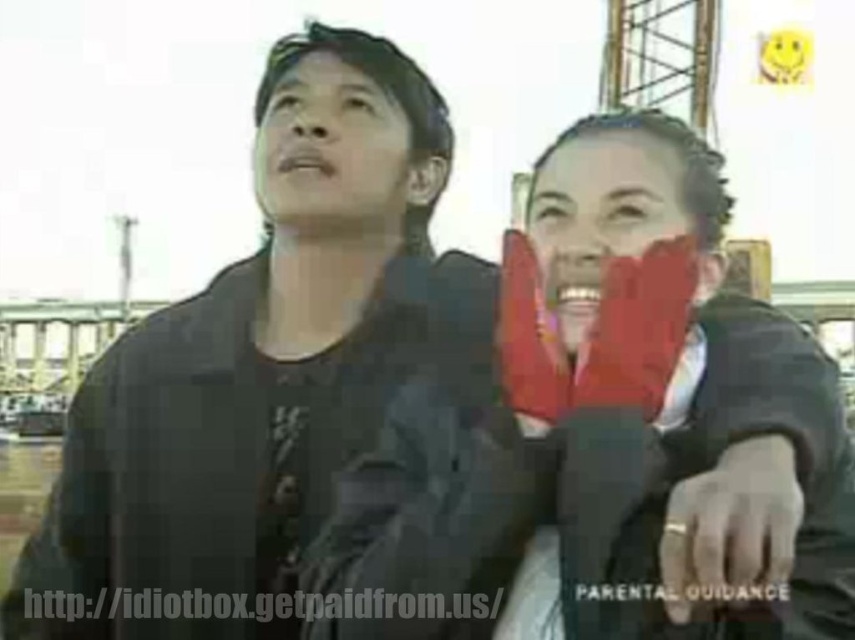
Who is lower down, matte black face at upper center or matte red gloves at center?

matte red gloves at center

Does matte black face at upper center have a greater width compared to matte red gloves at center?

Incorrect, matte black face at upper center's width does not surpass matte red gloves at center's.

Describe the element at coordinates (331, 148) in the screenshot. I see `matte black face at upper center` at that location.

At what (x,y) coordinates should I click in order to perform the action: click on matte black face at upper center. Please return your answer as a coordinate pair (x, y). Looking at the image, I should click on (331, 148).

Does matte black gloves at center have a smaller size compared to matte black face at upper center?

No, matte black gloves at center is not smaller than matte black face at upper center.

Is matte black gloves at center above matte black face at upper center?

No, matte black gloves at center is not above matte black face at upper center.

At what (x,y) coordinates should I click in order to perform the action: click on matte black gloves at center. Please return your answer as a coordinate pair (x, y). This screenshot has width=855, height=640. Looking at the image, I should click on (709, 380).

The height and width of the screenshot is (640, 855). Find the location of `matte black gloves at center`. matte black gloves at center is located at coordinates (709, 380).

Is matte black gloves at center wider than matte red gloves at center?

Correct, the width of matte black gloves at center exceeds that of matte red gloves at center.

Is point (750, 492) closer to viewer compared to point (605, 141)?

Yes, it is.

The width and height of the screenshot is (855, 640). In order to click on matte black gloves at center in this screenshot , I will do `click(709, 380)`.